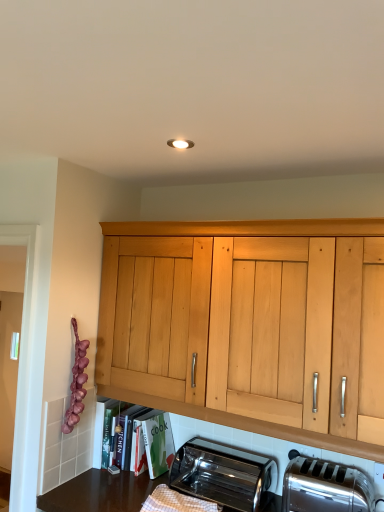
Question: Can we say matte wooden shelf at lower center lies outside polished stainless steel toaster at lower center, the second toaster viewed from the right?

Choices:
 (A) no
 (B) yes

Answer: (B)

Question: Can you confirm if matte wooden shelf at lower center is bigger than polished stainless steel toaster at lower center, the second toaster viewed from the right?

Choices:
 (A) yes
 (B) no

Answer: (A)

Question: Can you confirm if matte wooden shelf at lower center is shorter than polished stainless steel toaster at lower center, the second toaster viewed from the right?

Choices:
 (A) no
 (B) yes

Answer: (A)

Question: Considering the relative positions of matte wooden shelf at lower center and polished stainless steel toaster at lower center, positioned as the first toaster in left-to-right order, in the image provided, is matte wooden shelf at lower center to the right of polished stainless steel toaster at lower center, positioned as the first toaster in left-to-right order, from the viewer's perspective?

Choices:
 (A) yes
 (B) no

Answer: (B)

Question: From a real-world perspective, is matte wooden shelf at lower center on top of polished stainless steel toaster at lower center, positioned as the first toaster in left-to-right order?

Choices:
 (A) no
 (B) yes

Answer: (B)

Question: From the image's perspective, is matte wooden shelf at lower center above or below satin silver toaster at lower right, which appears as the 2th toaster when viewed from the left?

Choices:
 (A) below
 (B) above

Answer: (B)

Question: Is matte wooden shelf at lower center to the left or to the right of satin silver toaster at lower right, which appears as the 2th toaster when viewed from the left, in the image?

Choices:
 (A) right
 (B) left

Answer: (B)

Question: Is matte wooden shelf at lower center wider or thinner than satin silver toaster at lower right, which appears as the 2th toaster when viewed from the left?

Choices:
 (A) wide
 (B) thin

Answer: (A)

Question: From a real-world perspective, relative to satin silver toaster at lower right, the first toaster positioned from the right, is matte wooden shelf at lower center vertically above or below?

Choices:
 (A) above
 (B) below

Answer: (A)

Question: From their relative heights in the image, would you say matte wooden shelf at lower center is taller or shorter than polished stainless steel toaster at lower center, the second toaster viewed from the right?

Choices:
 (A) short
 (B) tall

Answer: (B)

Question: Relative to polished stainless steel toaster at lower center, positioned as the first toaster in left-to-right order, is matte wooden shelf at lower center in front or behind?

Choices:
 (A) front
 (B) behind

Answer: (B)

Question: Is matte wooden shelf at lower center inside or outside of polished stainless steel toaster at lower center, the second toaster viewed from the right?

Choices:
 (A) inside
 (B) outside

Answer: (B)

Question: From a real-world perspective, is matte wooden shelf at lower center physically located above or below polished stainless steel toaster at lower center, the second toaster viewed from the right?

Choices:
 (A) below
 (B) above

Answer: (B)

Question: From the image's perspective, is satin silver toaster at lower right, the first toaster positioned from the right, located above or below matte wooden shelf at lower center?

Choices:
 (A) below
 (B) above

Answer: (A)

Question: Is satin silver toaster at lower right, which appears as the 2th toaster when viewed from the left, spatially inside matte wooden shelf at lower center, or outside of it?

Choices:
 (A) outside
 (B) inside

Answer: (A)